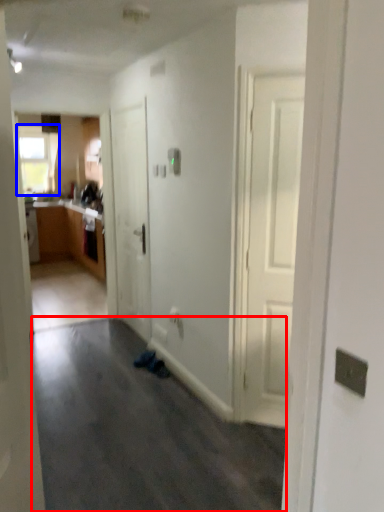
Question: Which object is further to the camera taking this photo, plain (highlighted by a red box) or window (highlighted by a blue box)?

Choices:
 (A) plain
 (B) window

Answer: (B)